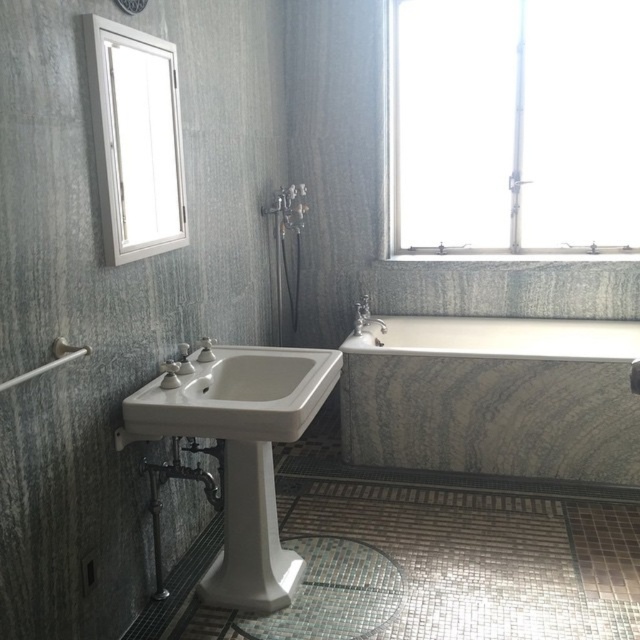
Question: Which object is closer to the camera taking this photo?

Choices:
 (A) matte silver faucet at center
 (B) white glossy mirror at upper left

Answer: (B)

Question: Which object appears farthest from the camera in this image?

Choices:
 (A) white porcelain sink at center
 (B) transparent glass window at upper right
 (C) matte silver faucet at center
 (D) white porcelain sink at lower left

Answer: (C)

Question: Is transparent glass window at upper right thinner than white glossy mirror at upper left?

Choices:
 (A) no
 (B) yes

Answer: (A)

Question: Which point is closer to the camera taking this photo?

Choices:
 (A) (198, 392)
 (B) (182, 401)
 (C) (356, 316)

Answer: (B)

Question: Where is transparent glass window at upper right located in relation to marble bathtub at center in the image?

Choices:
 (A) left
 (B) right

Answer: (B)

Question: Observing the image, what is the correct spatial positioning of white porcelain sink at center in reference to matte silver faucet at center?

Choices:
 (A) below
 (B) above

Answer: (A)